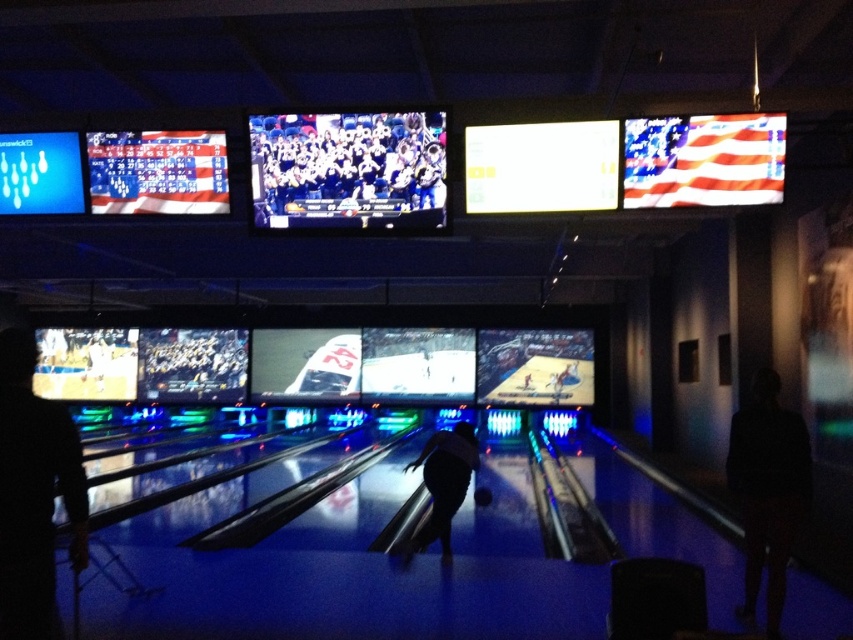
Who is more distant from viewer, (334,161) or (792,436)?

The point (334,161) is behind.

Is white fabric group at center shorter than dark fabric at right?

Yes.

Is point (254, 170) closer to viewer compared to point (753, 440)?

No, it is behind (753, 440).

Where is `white fabric group at center`? The height and width of the screenshot is (640, 853). white fabric group at center is located at coordinates (347, 170).

Who is positioned more to the right, black fabric at left or silhouette bowling ball at center?

silhouette bowling ball at center

Between black fabric at left and silhouette bowling ball at center, which one appears on the left side from the viewer's perspective?

black fabric at left

Which is in front, point (36, 609) or point (463, 476)?

Point (36, 609) is in front.

Locate an element on the screen. Image resolution: width=853 pixels, height=640 pixels. black fabric at left is located at coordinates (33, 492).

Does dark fabric at right have a greater height compared to silhouette bowling ball at center?

Yes, dark fabric at right is taller than silhouette bowling ball at center.

Between dark fabric at right and silhouette bowling ball at center, which one has less height?

Standing shorter between the two is silhouette bowling ball at center.

Who is more distant from viewer, (744, 467) or (465, 465)?

The point (465, 465) is behind.

Identify the location of dark fabric at right. The width and height of the screenshot is (853, 640). (767, 490).